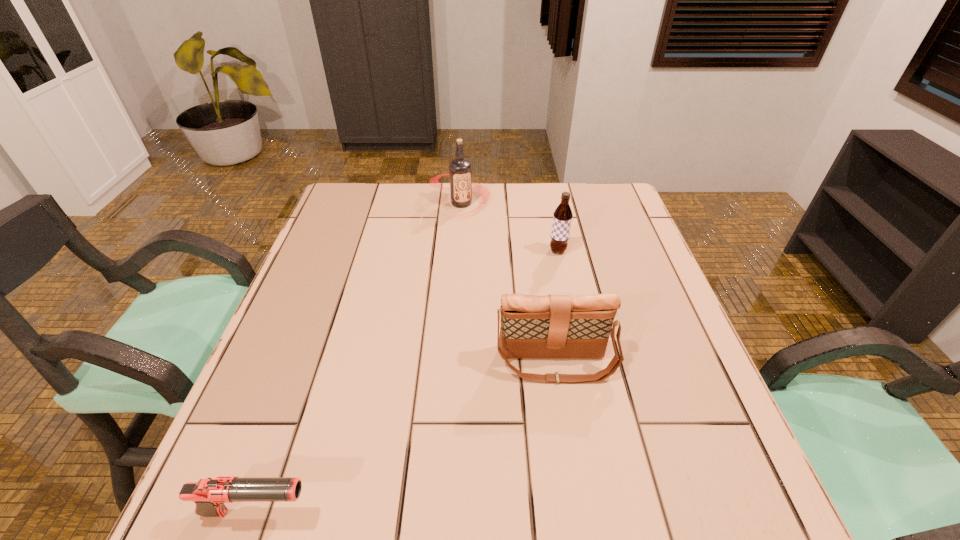
Identify which object is located as the second nearest to the right root beer. Please provide its 2D coordinates. Your answer should be formatted as a tuple, i.e. [(x, y)], where the tuple contains the x and y coordinates of a point satisfying the conditions above.

[(553, 326)]

Find the location of `free location that satisfies the following two spatial constraints: 1. on the front-facing side of the third farthest object; 2. at the aiming end of the leftmost object`. free location that satisfies the following two spatial constraints: 1. on the front-facing side of the third farthest object; 2. at the aiming end of the leftmost object is located at coordinates (579, 513).

You are a GUI agent. You are given a task and a screenshot of the screen. Output one action in this format:
    pyautogui.click(x=<x>, y=<y>)
    Task: Click on the blank space that satisfies the following two spatial constraints: 1. on the label of the right root beer; 2. on the left side of the second object from left to right
    The image size is (960, 540).
    Given the screenshot: What is the action you would take?
    pyautogui.click(x=459, y=251)

Identify the location of vacant space that satisfies the following two spatial constraints: 1. on the front-facing side of the third farthest object; 2. at the aiming end of the leftmost object. (579, 513).

You are a GUI agent. You are given a task and a screenshot of the screen. Output one action in this format:
    pyautogui.click(x=<x>, y=<y>)
    Task: Click on the blank space that satisfies the following two spatial constraints: 1. on the label of the left root beer; 2. on the right side of the third nearest object
    This screenshot has width=960, height=540.
    Given the screenshot: What is the action you would take?
    pyautogui.click(x=459, y=251)

This screenshot has height=540, width=960. Identify the location of vacant space that satisfies the following two spatial constraints: 1. on the front-facing side of the shoulder bag; 2. at the aiming end of the gun. (579, 513).

Where is `vacant point that satisfies the following two spatial constraints: 1. on the label of the third object from right to left; 2. on the right side of the second farthest object`? The height and width of the screenshot is (540, 960). vacant point that satisfies the following two spatial constraints: 1. on the label of the third object from right to left; 2. on the right side of the second farthest object is located at coordinates (459, 251).